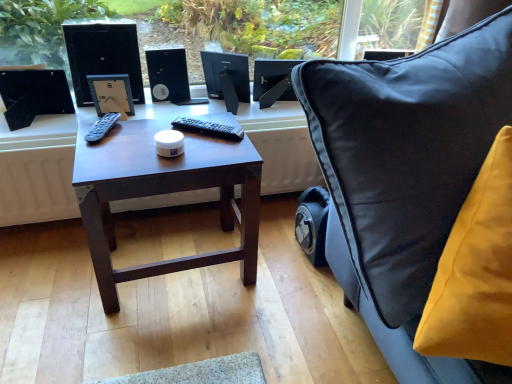
Locate an element on the screen. This screenshot has height=384, width=512. empty space that is ontop of dark wood table at center (from a real-world perspective) is located at coordinates (150, 149).